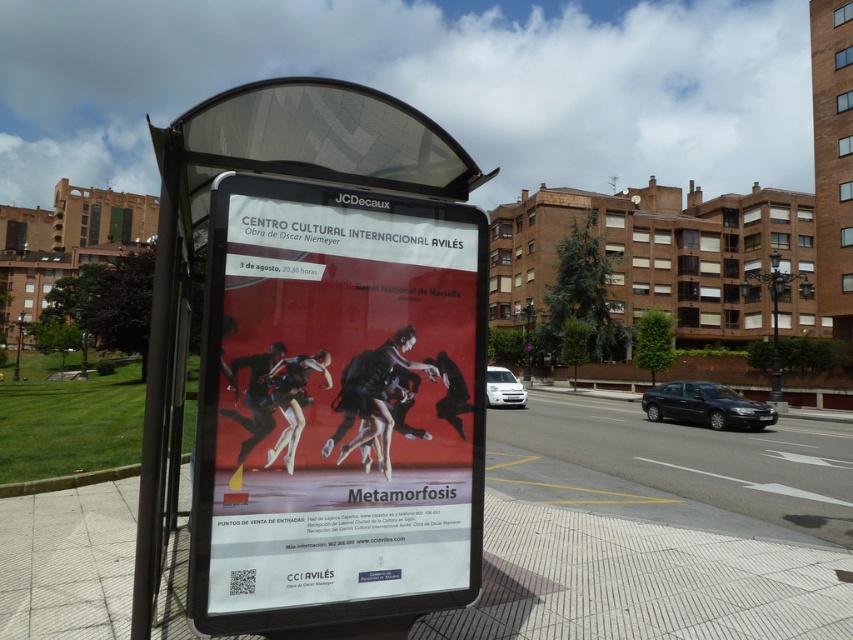
Question: Which point appears closest to the camera in this image?

Choices:
 (A) (471, 442)
 (B) (444, 612)

Answer: (A)

Question: Which point is closer to the camera?

Choices:
 (A) smooth concrete pavement at center
 (B) matte paper poster at center

Answer: (B)

Question: Which object is closer to the camera taking this photo?

Choices:
 (A) matte paper poster at center
 (B) smooth concrete pavement at center

Answer: (A)

Question: Does matte paper poster at center appear over smooth concrete pavement at center?

Choices:
 (A) no
 (B) yes

Answer: (B)

Question: Can you confirm if matte paper poster at center is positioned above smooth concrete pavement at center?

Choices:
 (A) no
 (B) yes

Answer: (B)

Question: Is matte paper poster at center to the left of smooth concrete pavement at center from the viewer's perspective?

Choices:
 (A) yes
 (B) no

Answer: (B)